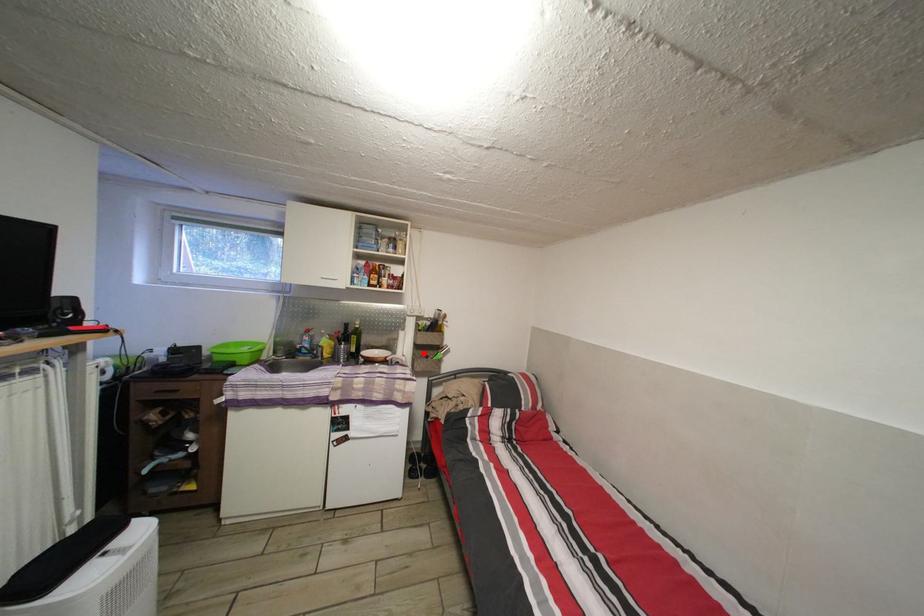
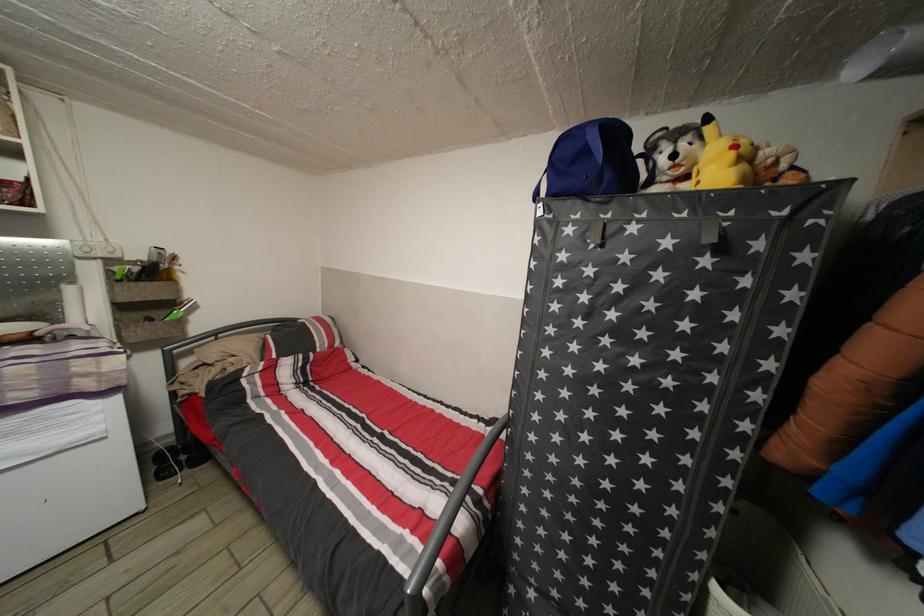
In the second image, find the point that corresponds to the highlighted location in the first image.

(128, 314)